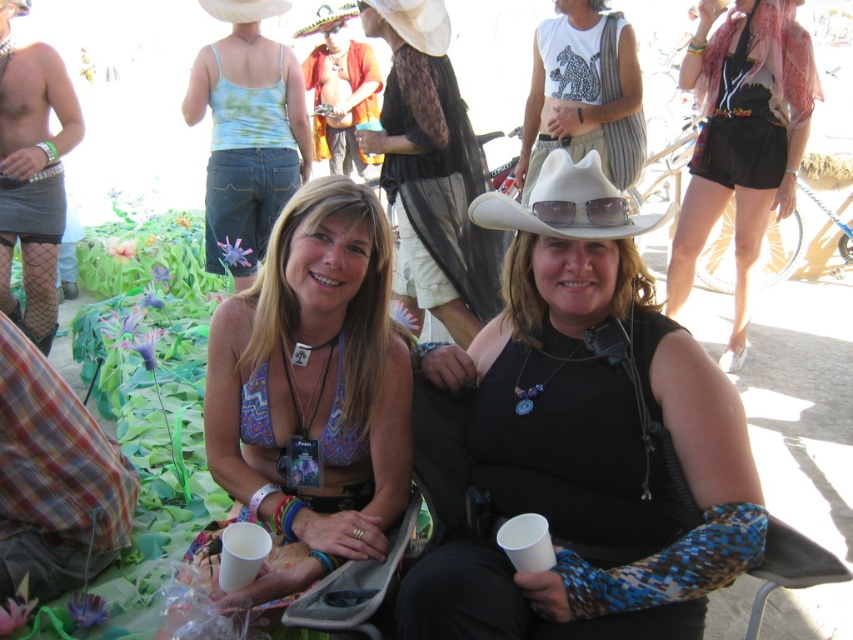
You are a photographer trying to capture a clear shot of both the black lace top at center and the white matte cowboy hat at upper center. Given their sizes, which object should you focus on first to ensure it fits within your camera frame?

The black lace top at center is larger in size than the white matte cowboy hat at upper center, so you should focus on capturing the black lace top at center first to ensure it fits within the camera frame before adjusting for the smaller object.